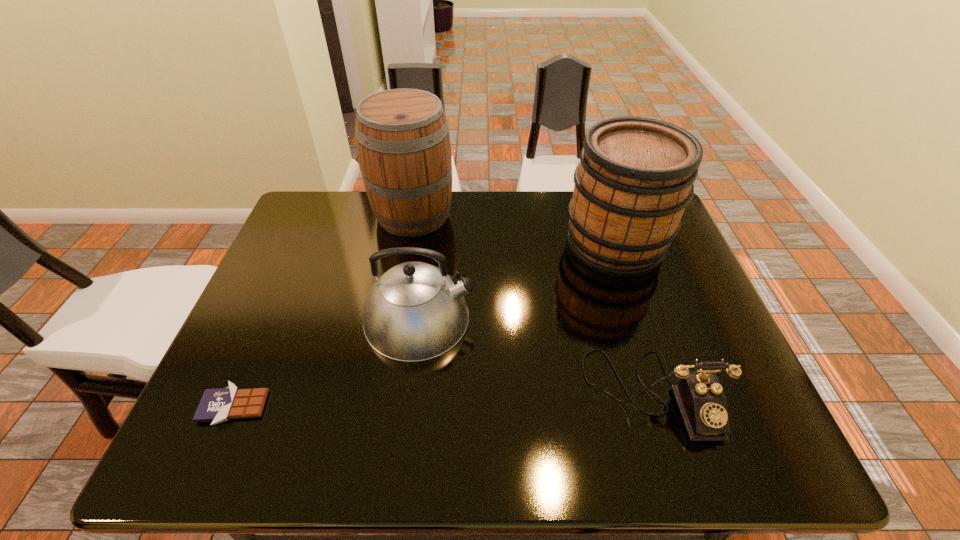
This screenshot has width=960, height=540. I want to click on telephone that is at the near edge, so click(x=702, y=403).

Identify the location of chocolate bar at the near edge. (217, 405).

Find the location of a particular element. object located in the left edge section of the desktop is located at coordinates (217, 405).

The width and height of the screenshot is (960, 540). I want to click on cider positioned at the right edge, so click(x=635, y=177).

You are a GUI agent. You are given a task and a screenshot of the screen. Output one action in this format:
    pyautogui.click(x=<x>, y=<y>)
    Task: Click on the telephone located at the right edge
    The width and height of the screenshot is (960, 540).
    Given the screenshot: What is the action you would take?
    pyautogui.click(x=702, y=403)

Where is `object situated at the near left corner`? The width and height of the screenshot is (960, 540). object situated at the near left corner is located at coordinates (217, 405).

The height and width of the screenshot is (540, 960). What are the coordinates of `object located at the far right corner` in the screenshot? It's located at (635, 177).

The width and height of the screenshot is (960, 540). Find the location of `object that is positioned at the near right corner`. object that is positioned at the near right corner is located at coordinates (702, 403).

In the image, there is a desktop. At what (x,y) coordinates should I click in order to perform the action: click on free region at the far edge. Please return your answer as a coordinate pair (x, y). The image size is (960, 540). Looking at the image, I should click on (471, 209).

Image resolution: width=960 pixels, height=540 pixels. I want to click on free space at the near edge, so tap(529, 464).